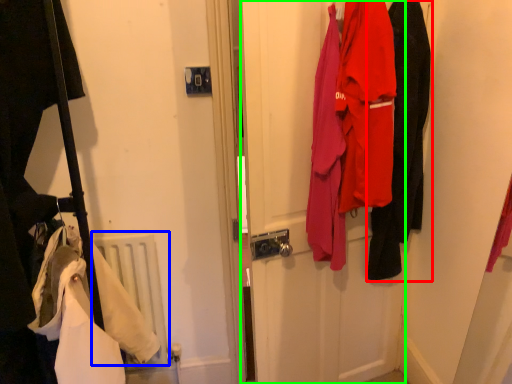
Question: Which object is positioned closest to clothing (highlighted by a red box)? Select from radiator (highlighted by a blue box) and door (highlighted by a green box).

Choices:
 (A) radiator
 (B) door

Answer: (B)